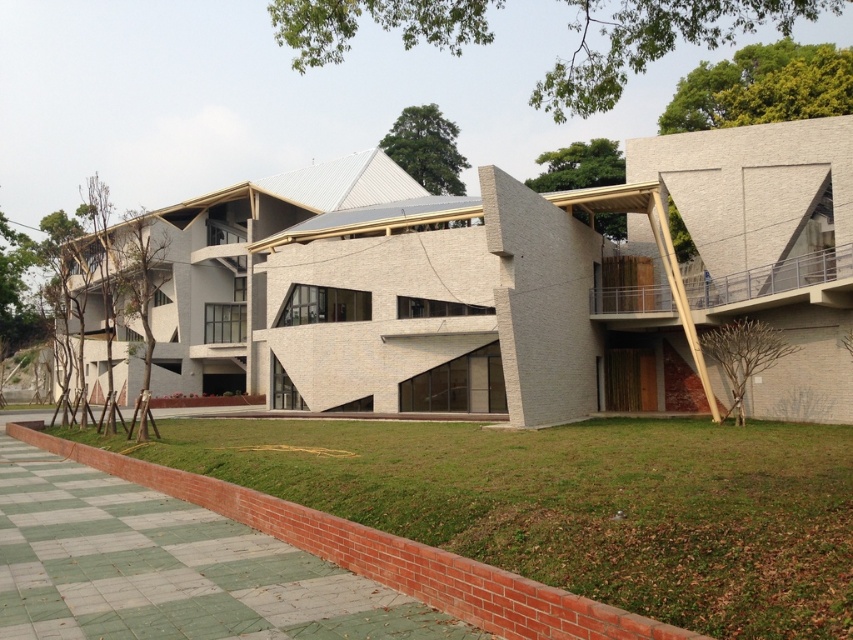
You are standing in front of the white textured building at center and looking towards the green grass at lower left. Which object is closer to you?

The white textured building at center is closer to you than the green grass at lower left because it is positioned further to the viewer.

In the scene shown: You are standing on the green grass at lower left and want to reach the entrance of the white textured building at center. Which direction should you move to get there?

You should move upwards towards the white textured building at center since it is located above the green grass at lower left.